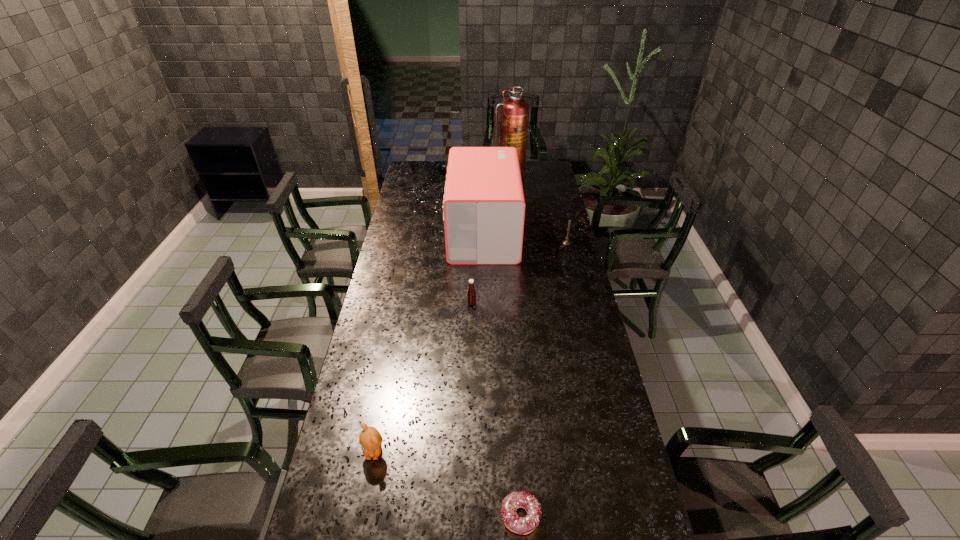
I want to click on the tallest object, so click(514, 117).

Identify the location of fire extinguisher. (514, 117).

Locate an element on the screen. This screenshot has height=540, width=960. the second tallest object is located at coordinates (484, 207).

Where is `candle`? candle is located at coordinates (566, 242).

Locate an element on the screen. This screenshot has width=960, height=540. Tabasco sauce is located at coordinates (471, 293).

Locate an element on the screen. The image size is (960, 540). the leftmost object is located at coordinates (370, 439).

The height and width of the screenshot is (540, 960). What are the coordinates of `teddy bear` in the screenshot? It's located at (370, 439).

Locate an element on the screen. the nearest object is located at coordinates (519, 499).

Find the location of a particular element. the shortest object is located at coordinates (519, 499).

Find the location of `free point located on the side of the tallest object with the label`. free point located on the side of the tallest object with the label is located at coordinates (513, 224).